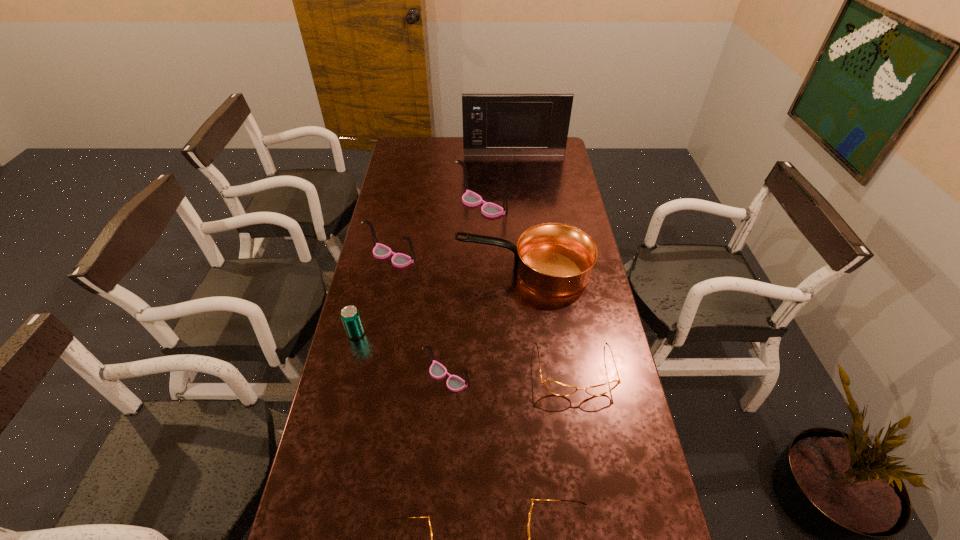
The image size is (960, 540). What are the coordinates of `vacant point located between the second farthest spectacles and the nearest pink spectacles` in the screenshot? It's located at (420, 316).

Image resolution: width=960 pixels, height=540 pixels. What are the coordinates of `object that is the eighth nearest to the frying pan` in the screenshot? It's located at (404, 517).

Locate an element on the screen. object that stands as the sixth closest to the teal beer can is located at coordinates (469, 198).

Point out which spectacles is positioned as the second nearest to the biggest gold spectacles. Please provide its 2D coordinates. Your answer should be formatted as a tuple, i.e. [(x, y)], where the tuple contains the x and y coordinates of a point satisfying the conditions above.

[(528, 531)]

The width and height of the screenshot is (960, 540). In order to click on the closest spectacles to the dark microwave oven in this screenshot , I will do `click(469, 198)`.

The height and width of the screenshot is (540, 960). What are the coordinates of `pink spectacles that is the second nearest to the eighth nearest object` in the screenshot? It's located at (454, 383).

Locate which pink spectacles ranks in proximity to the fifth tallest spectacles. Please provide its 2D coordinates. Your answer should be formatted as a tuple, i.e. [(x, y)], where the tuple contains the x and y coordinates of a point satisfying the conditions above.

[(454, 383)]

Locate which gold spectacles ranks in proximity to the shortest spectacles. Please provide its 2D coordinates. Your answer should be formatted as a tuple, i.e. [(x, y)], where the tuple contains the x and y coordinates of a point satisfying the conditions above.

[(528, 531)]

Locate an element on the screen. The width and height of the screenshot is (960, 540). gold spectacles that can be found as the closest to the shortest object is located at coordinates (528, 531).

This screenshot has width=960, height=540. I want to click on vacant region that satisfies the following two spatial constraints: 1. on the front panel of the microwave oven; 2. on the handle side of the frying pan, so click(526, 269).